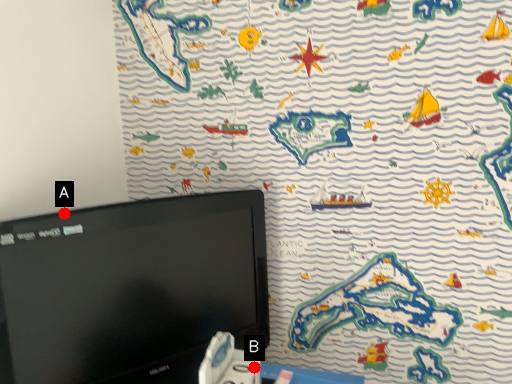
Question: Two points are circled on the image, labeled by A and B beside each circle. Which point is closer to the camera taking this photo?

Choices:
 (A) A is closer
 (B) B is closer

Answer: (B)